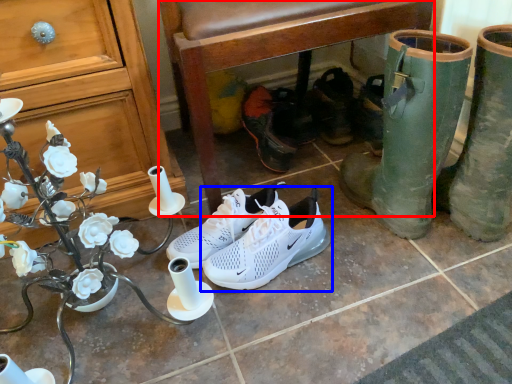
Question: Among these objects, which one is nearest to the camera, chair (highlighted by a red box) or footwear (highlighted by a blue box)?

Choices:
 (A) chair
 (B) footwear

Answer: (A)